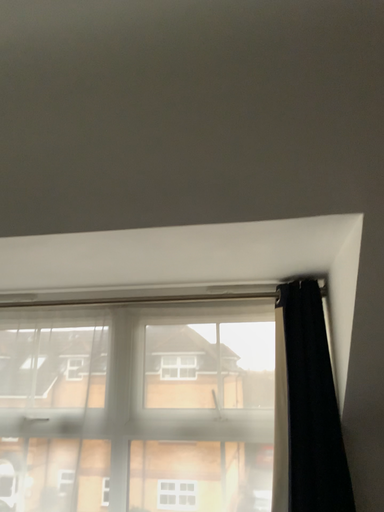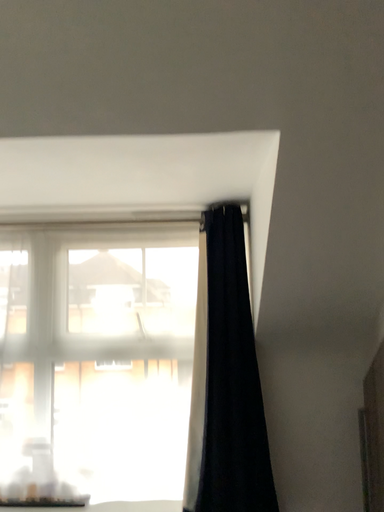
Question: Which way did the camera rotate in the video?

Choices:
 (A) rotated upward
 (B) rotated downward

Answer: (B)